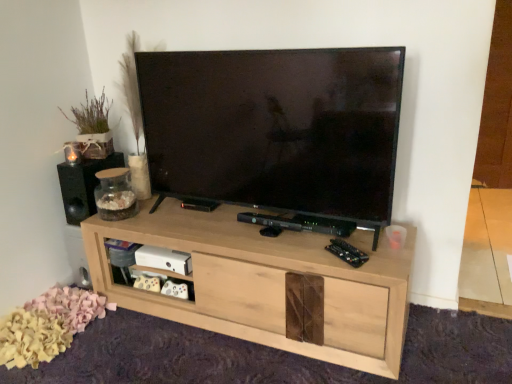
Question: From their relative heights in the image, would you say black matte speaker at left is taller or shorter than natural wood cabinet at center?

Choices:
 (A) short
 (B) tall

Answer: (A)

Question: From the image's perspective, relative to natural wood cabinet at center, is black matte speaker at left above or below?

Choices:
 (A) above
 (B) below

Answer: (A)

Question: Is point (74, 167) positioned closer to the camera than point (215, 299)?

Choices:
 (A) farther
 (B) closer

Answer: (A)

Question: Would you say natural wood cabinet at center is inside or outside black matte speaker at left?

Choices:
 (A) inside
 (B) outside

Answer: (B)

Question: Considering their positions, is natural wood cabinet at center located in front of or behind black matte speaker at left?

Choices:
 (A) behind
 (B) front

Answer: (B)

Question: In terms of size, does natural wood cabinet at center appear bigger or smaller than black matte speaker at left?

Choices:
 (A) big
 (B) small

Answer: (A)

Question: Considering the positions of natural wood cabinet at center and black matte speaker at left in the image, is natural wood cabinet at center wider or thinner than black matte speaker at left?

Choices:
 (A) wide
 (B) thin

Answer: (A)